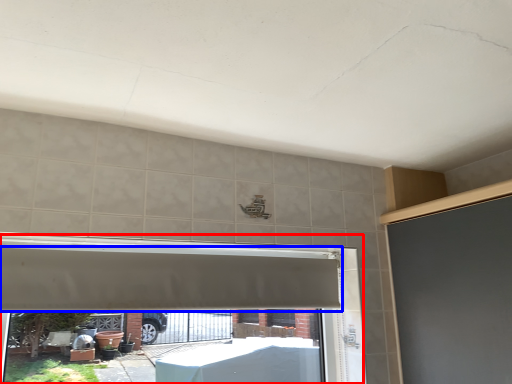
Question: Which object appears closest to the camera in this image, window frame (highlighted by a red box) or exhaust hood (highlighted by a blue box)?

Choices:
 (A) window frame
 (B) exhaust hood

Answer: (A)